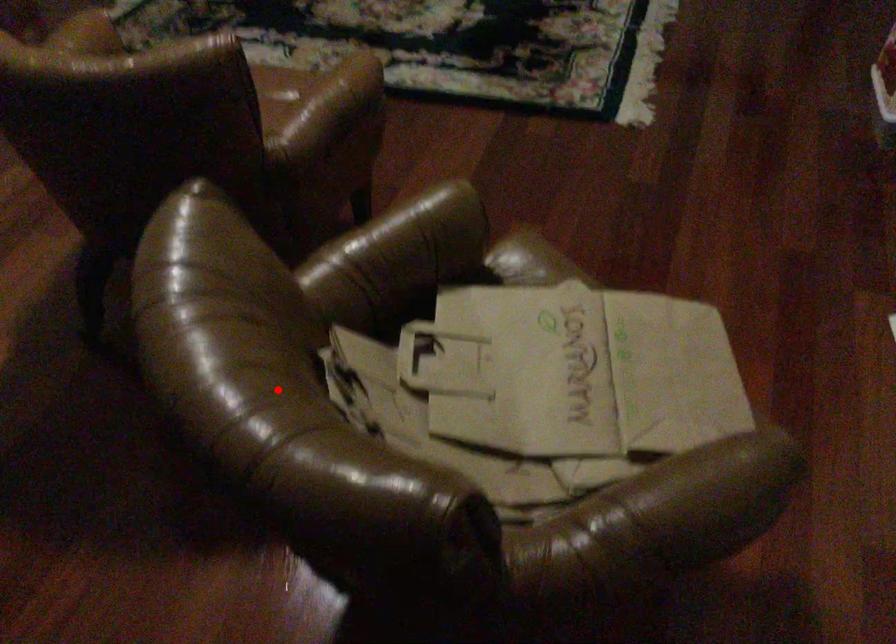
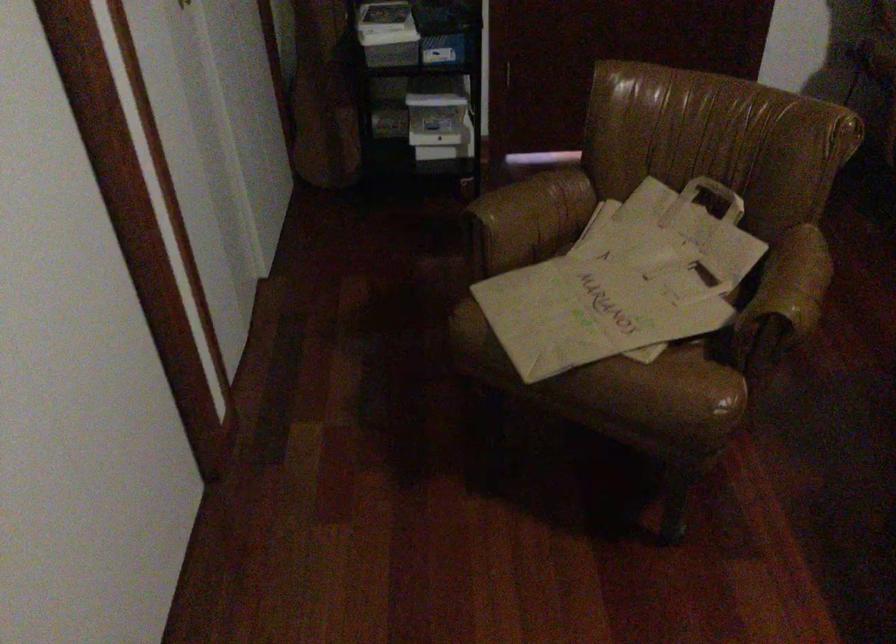
Question: I am providing you with two images of the same scene from different viewpoints. In image1, a red point is highlighted. Considering the same 3D point in image2, which of the following is correct?

Choices:
 (A) It is closer
 (B) It is farther

Answer: (B)